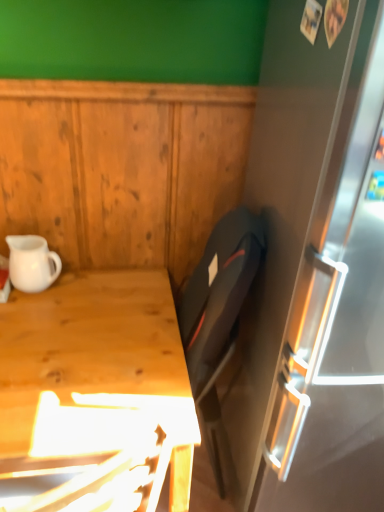
The height and width of the screenshot is (512, 384). Describe the element at coordinates (95, 354) in the screenshot. I see `light wood desk at lower left` at that location.

The width and height of the screenshot is (384, 512). Find the location of `light wood desk at lower left`. light wood desk at lower left is located at coordinates (95, 354).

Measure the distance between light wood desk at lower left and camera.

The distance of light wood desk at lower left from camera is 37.06 inches.

Describe the element at coordinates (32, 263) in the screenshot. This screenshot has height=512, width=384. I see `white matte pitcher at left` at that location.

Identify the location of white matte pitcher at left. (32, 263).

Identify the location of light wood desk at lower left. (95, 354).

Is light wood desk at lower left to the left or to the right of white matte pitcher at left in the image?

In the image, light wood desk at lower left appears on the right side of white matte pitcher at left.

Between light wood desk at lower left and white matte pitcher at left, which one is positioned in front?

light wood desk at lower left.

Does point (173, 460) come in front of point (39, 271)?

Yes, point (173, 460) is closer to viewer.

From the image's perspective, relative to white matte pitcher at left, is light wood desk at lower left above or below?

Clearly, from the image's perspective, light wood desk at lower left is below white matte pitcher at left.

From a real-world perspective, is light wood desk at lower left above or below white matte pitcher at left?

light wood desk at lower left is below white matte pitcher at left.

Can you confirm if light wood desk at lower left is thinner than white matte pitcher at left?

Incorrect, the width of light wood desk at lower left is not less than that of white matte pitcher at left.

Does light wood desk at lower left have a greater height compared to white matte pitcher at left?

Yes, light wood desk at lower left is taller than white matte pitcher at left.

Who is bigger, light wood desk at lower left or white matte pitcher at left?

With larger size is light wood desk at lower left.

Would you say light wood desk at lower left is outside white matte pitcher at left?

Absolutely, light wood desk at lower left is external to white matte pitcher at left.

Would you consider light wood desk at lower left to be distant from white matte pitcher at left?

No.

Does light wood desk at lower left turn towards white matte pitcher at left?

No, light wood desk at lower left does not turn towards white matte pitcher at left.

How far apart are light wood desk at lower left and white matte pitcher at left?

A distance of 11.10 inches exists between light wood desk at lower left and white matte pitcher at left.

Locate an element on the screen. Image resolution: width=384 pixels, height=512 pixels. coffee cup above the light wood desk at lower left (from the image's perspective) is located at coordinates (32, 263).

In the image, is white matte pitcher at left on the left side or the right side of light wood desk at lower left?

From the image, it's evident that white matte pitcher at left is to the left of light wood desk at lower left.

Is white matte pitcher at left closer to the viewer compared to light wood desk at lower left?

That is False.

Which is closer to the camera, (48, 279) or (186, 471)?

The point (186, 471) is closer.

From the image's perspective, which one is positioned higher, white matte pitcher at left or light wood desk at lower left?

white matte pitcher at left, from the image's perspective.

From the picture: From a real-world perspective, is white matte pitcher at left above or below light wood desk at lower left?

In terms of real-world spatial position, white matte pitcher at left is above light wood desk at lower left.

Considering the sizes of objects white matte pitcher at left and light wood desk at lower left in the image provided, who is wider, white matte pitcher at left or light wood desk at lower left?

light wood desk at lower left.

Considering the relative sizes of white matte pitcher at left and light wood desk at lower left in the image provided, is white matte pitcher at left taller than light wood desk at lower left?

Incorrect, the height of white matte pitcher at left is not larger of that of light wood desk at lower left.

Can you confirm if white matte pitcher at left is smaller than light wood desk at lower left?

Yes.

Do you think white matte pitcher at left is within light wood desk at lower left, or outside of it?

The correct answer is: outside.

Would you consider white matte pitcher at left to be distant from light wood desk at lower left?

That's not correct — white matte pitcher at left is a little close to light wood desk at lower left.

Is white matte pitcher at left positioned with its back to light wood desk at lower left?

That's not correct — white matte pitcher at left is not looking away from light wood desk at lower left.

Identify the location of coffee cup that appears above the light wood desk at lower left (from the image's perspective). (32, 263).

Locate an element on the screen. The width and height of the screenshot is (384, 512). desk that appears in front of the white matte pitcher at left is located at coordinates (95, 354).

Locate an element on the screen. The height and width of the screenshot is (512, 384). coffee cup lying behind the light wood desk at lower left is located at coordinates (32, 263).